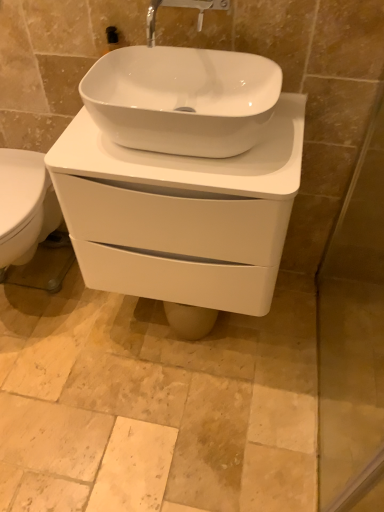
Question: From the image's perspective, is white glossy sink at center positioned above or below transparent glass screen door at right?

Choices:
 (A) below
 (B) above

Answer: (B)

Question: In the image, is white glossy sink at center positioned in front of or behind transparent glass screen door at right?

Choices:
 (A) front
 (B) behind

Answer: (B)

Question: Which of these objects is positioned farthest from the transparent glass screen door at right?

Choices:
 (A) matte silver faucet at upper center
 (B) white glossy porcelain at center
 (C) white glossy sink at center

Answer: (A)

Question: Considering the real-world distances, which object is closest to the transparent glass screen door at right?

Choices:
 (A) matte silver faucet at upper center
 (B) white glossy sink at center
 (C) white glossy porcelain at center

Answer: (C)